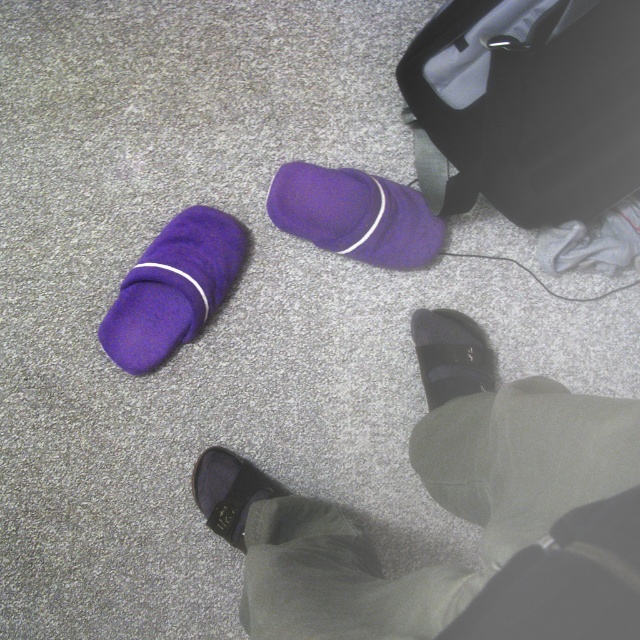
You are trying to choose between the black leather sandals at lower center and the velvet black slipper at lower center for a trip. If you want to pick the wider footwear, which one should you choose?

The black leather sandals at lower center are wider than the velvet black slipper at lower center, so you should choose the black leather sandals at lower center.

Based on the photo, you are a delivery robot with a width of 24 inches. You need to move from the entrance to the matte black suitcase at upper right. There is a velvet black slipper at lower center in your path. Can you navigate around the slipper without moving it?

The matte black suitcase at upper right and velvet black slipper at lower center are 24.75 inches apart. Since the robot is 24 inches wide, there is enough space between them to navigate around the slipper without moving it.

You are a person standing in a room and see the black leather sandals at lower center and the velvet black slipper at lower center. Which object is directly on top of the other?

The black leather sandals at lower center is positioned over the velvet black slipper at lower center.